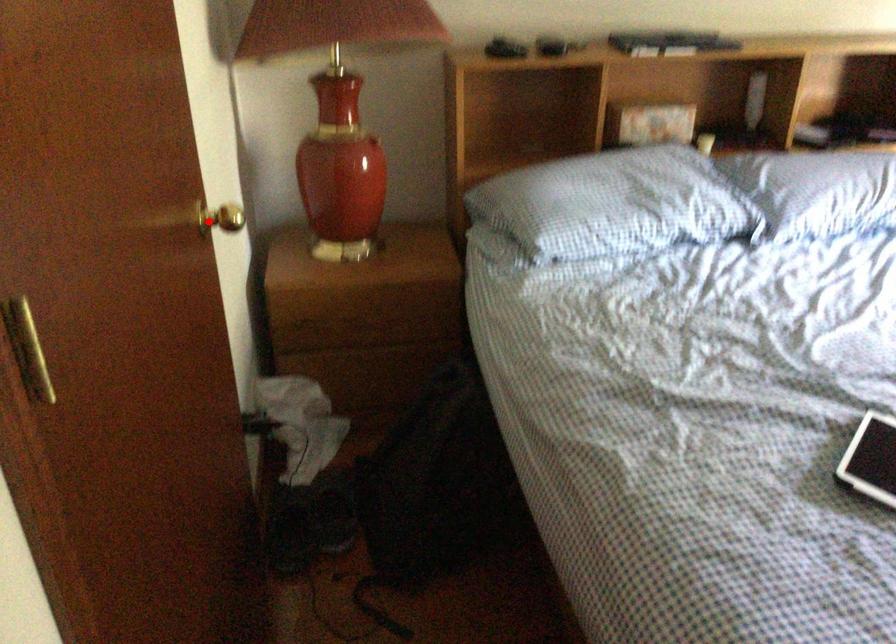
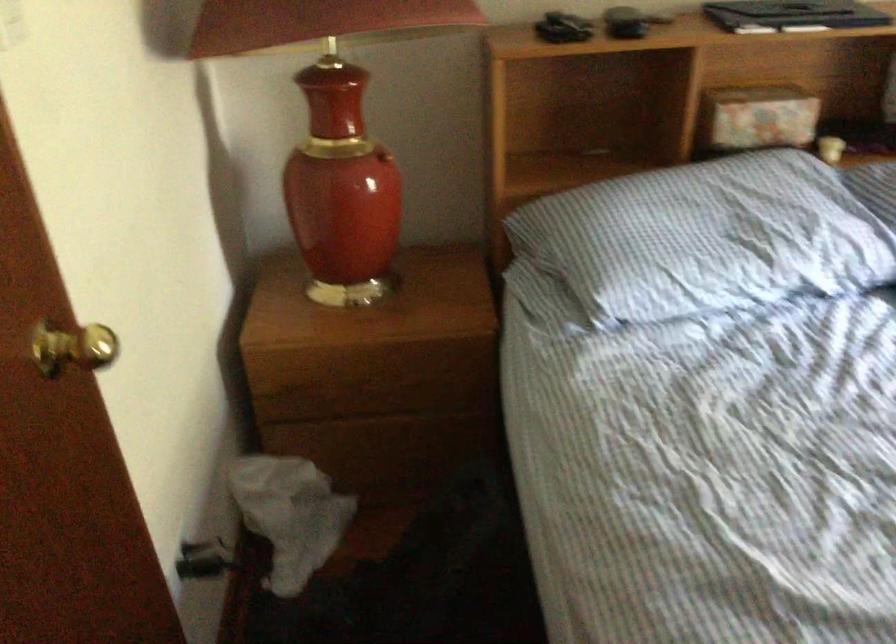
Find the pixel in the second image that matches the highlighted location in the first image.

(73, 348)